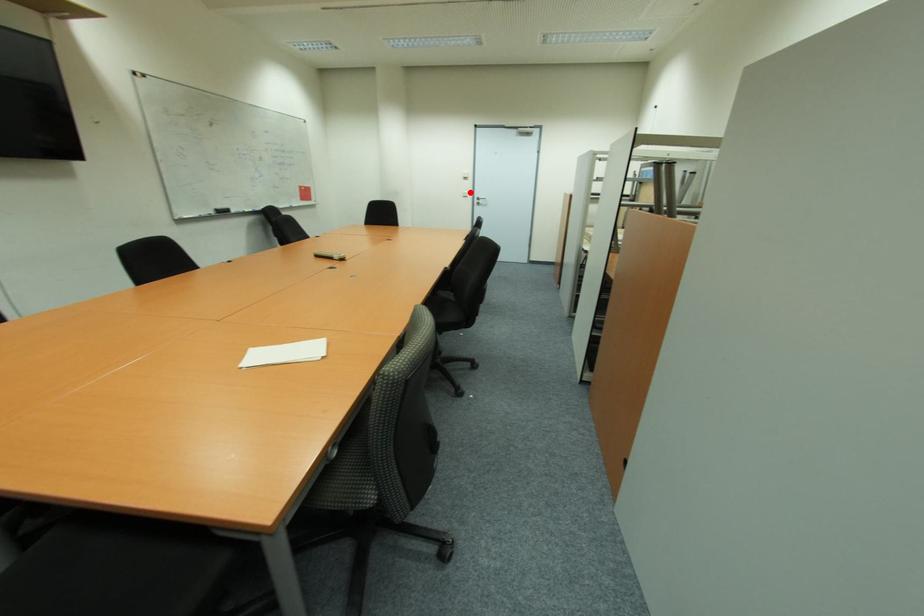
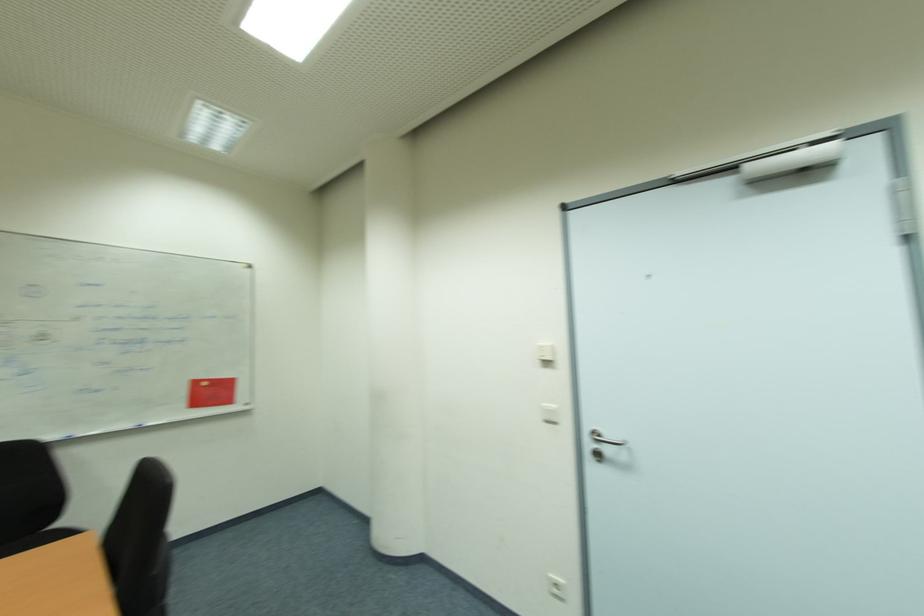
Find the pixel in the second image that matches the highlighted location in the first image.

(556, 407)